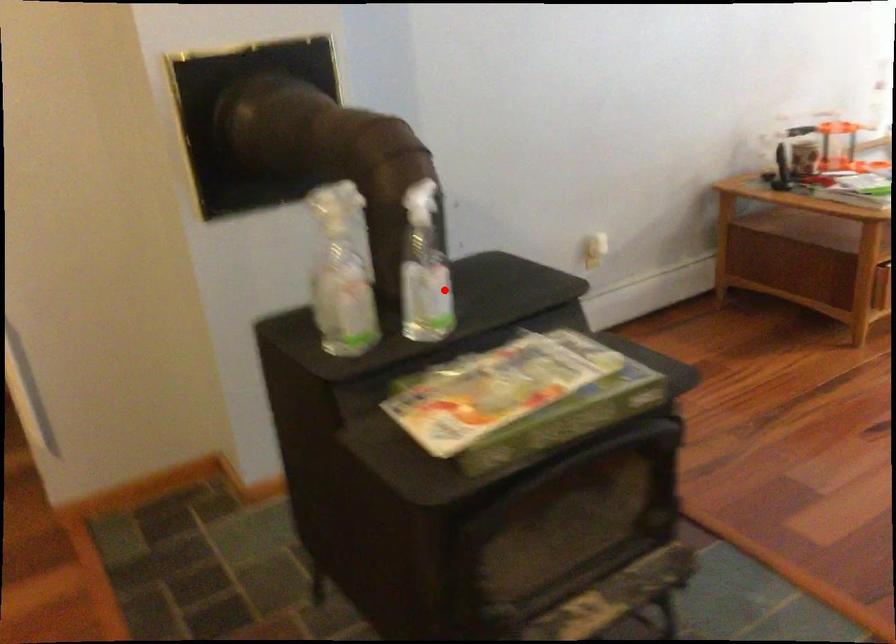
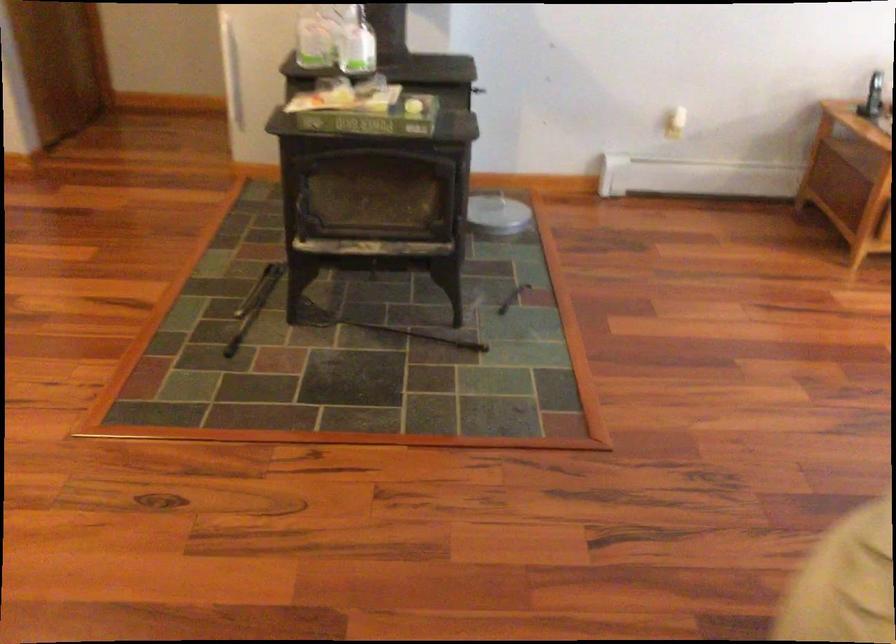
Where in the second image is the point corresponding to the highlighted location from the first image?

(357, 46)